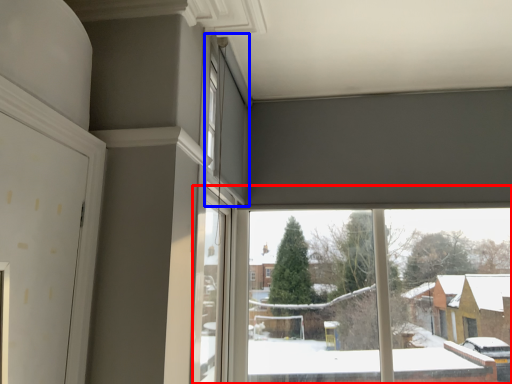
Question: Which object appears farthest to the camera in this image, window (highlighted by a red box) or window (highlighted by a blue box)?

Choices:
 (A) window
 (B) window

Answer: (A)